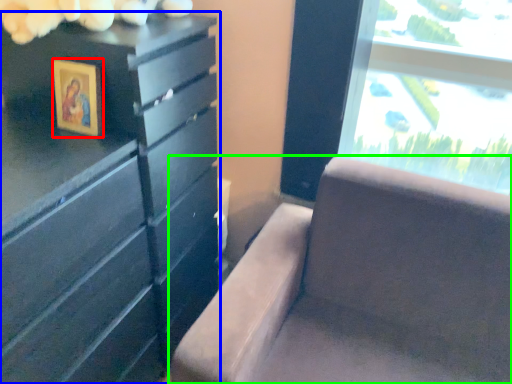
Question: Estimate the real-world distances between objects in this image. Which object is farther from picture frame (highlighted by a red box), chest of drawers (highlighted by a blue box) or furniture (highlighted by a green box)?

Choices:
 (A) chest of drawers
 (B) furniture

Answer: (B)